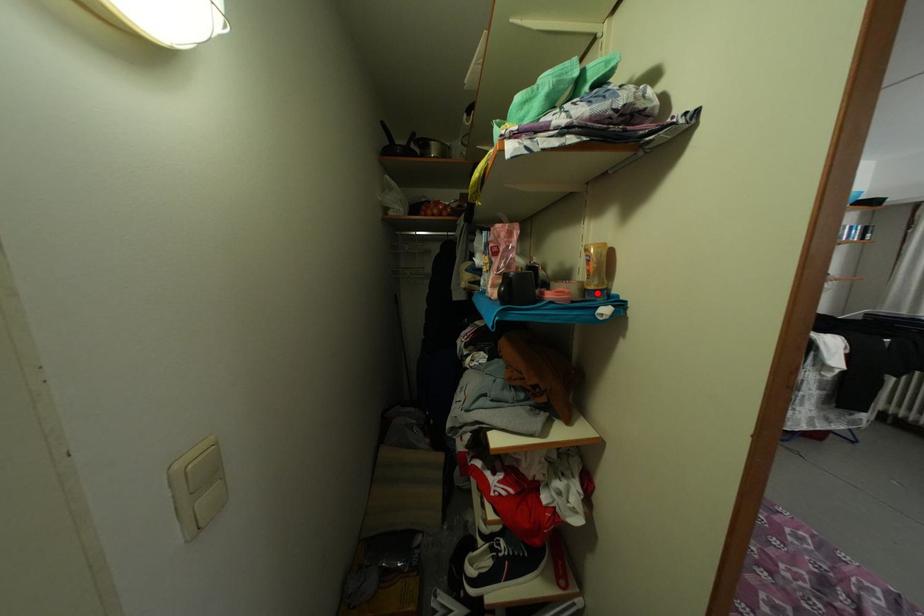
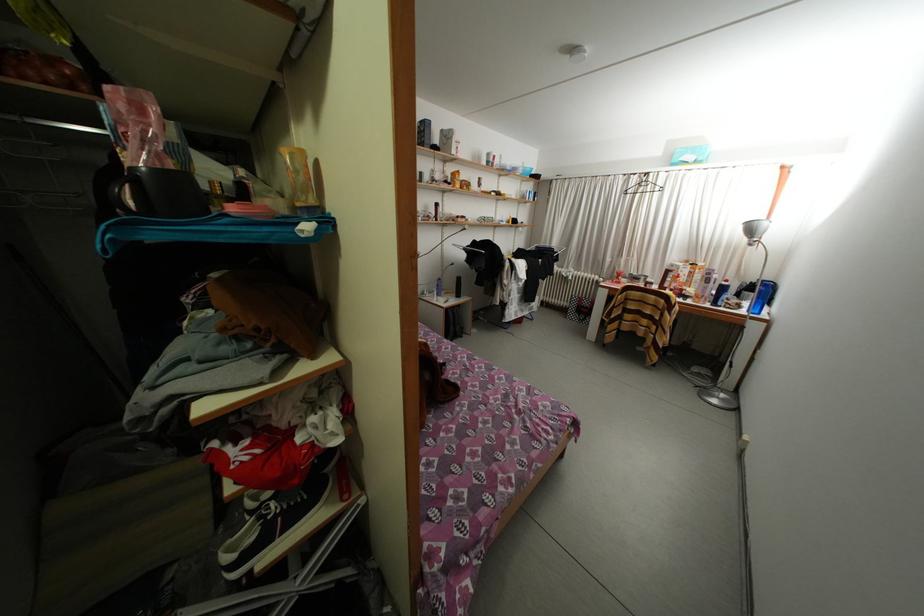
In the second image, find the point that corresponds to the highlighted location in the first image.

(306, 209)